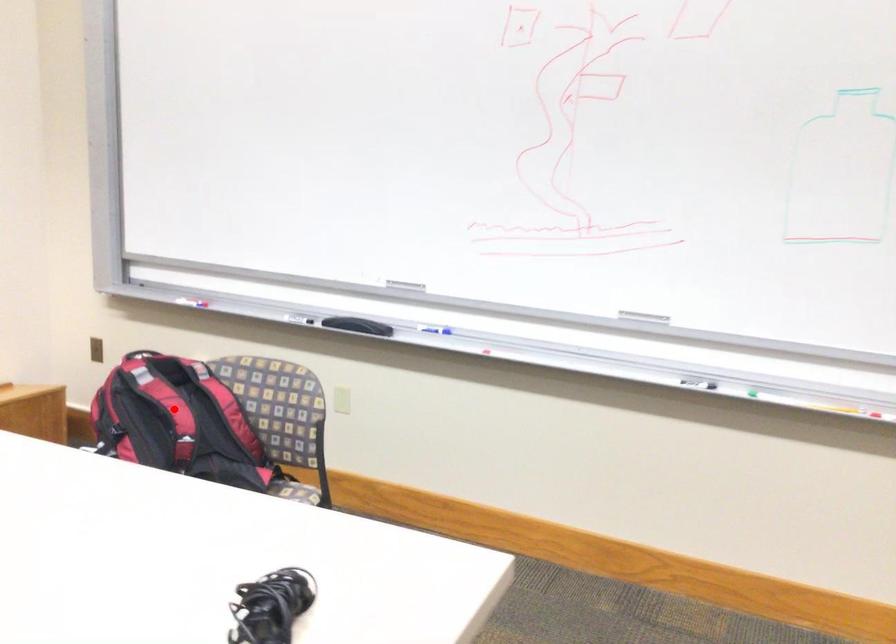
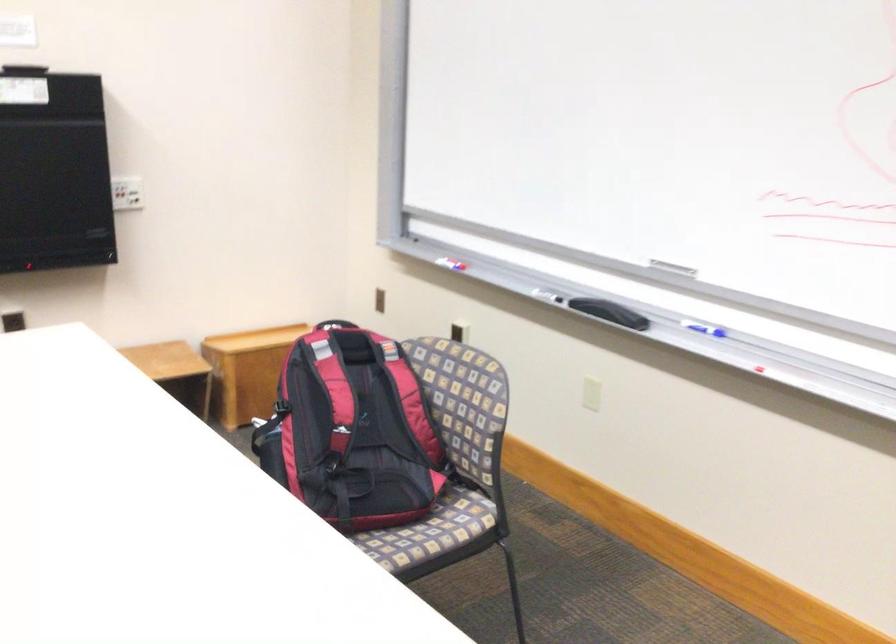
In the second image, find the point that corresponds to the highlighted location in the first image.

(334, 391)